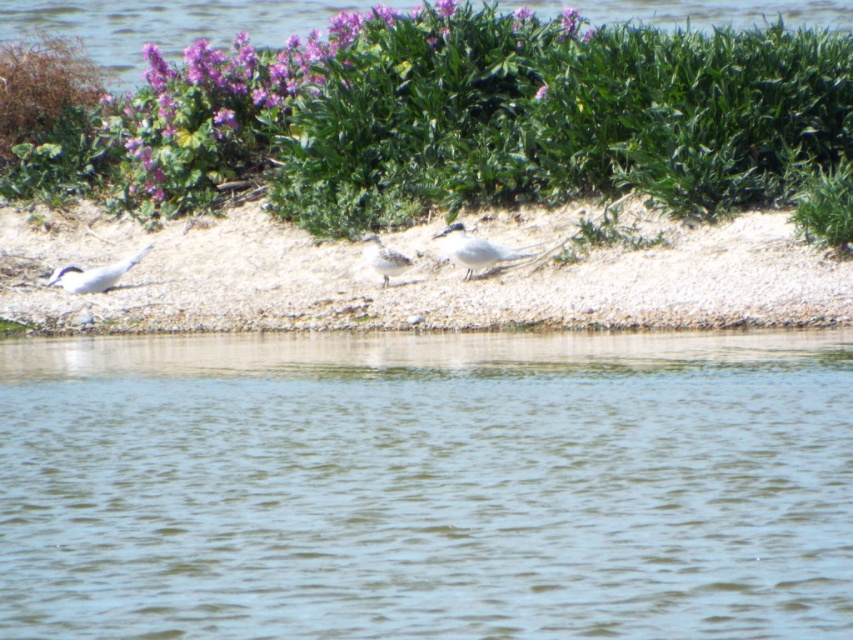
Does green leafy shrubs at upper center have a greater height compared to white matte bird at left?

Yes, green leafy shrubs at upper center is taller than white matte bird at left.

Which is below, green leafy shrubs at upper center or white matte bird at left?

white matte bird at left is below.

The width and height of the screenshot is (853, 640). What do you see at coordinates (508, 118) in the screenshot? I see `green leafy shrubs at upper center` at bounding box center [508, 118].

This screenshot has height=640, width=853. Find the location of `green leafy shrubs at upper center`. green leafy shrubs at upper center is located at coordinates (508, 118).

Who is positioned more to the right, clear water at upper center or white glossy bird at center?

white glossy bird at center

Who is more forward, (107,49) or (451,230)?

Point (451,230) is in front.

Between point (517, 1) and point (502, 259), which one is positioned behind?

The point (517, 1) is behind.

The image size is (853, 640). I want to click on clear water at upper center, so click(166, 24).

Which of these two, white gravelly sand at center or white matte bird at left, stands taller?

With more height is white matte bird at left.

Is white gravelly sand at center shorter than white matte bird at left?

Correct, white gravelly sand at center is not as tall as white matte bird at left.

Is point (547, 264) less distant than point (82, 284)?

Yes, point (547, 264) is closer to viewer.

Locate an element on the screen. Image resolution: width=853 pixels, height=640 pixels. white gravelly sand at center is located at coordinates (418, 278).